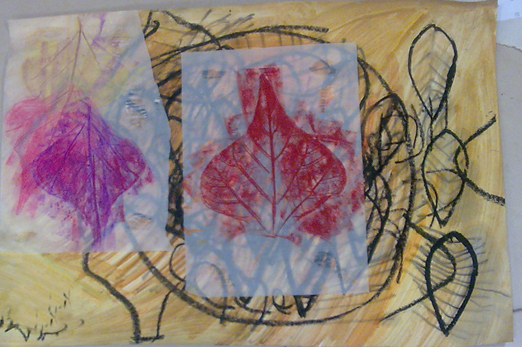
Identify the location of table under paper. The height and width of the screenshot is (347, 522). (509, 98).